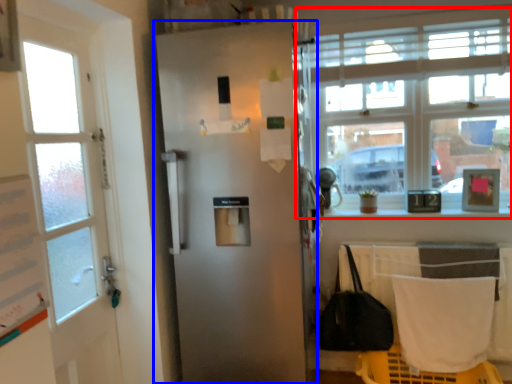
Question: Which object appears farthest to the camera in this image, window (highlighted by a red box) or door (highlighted by a blue box)?

Choices:
 (A) window
 (B) door

Answer: (A)